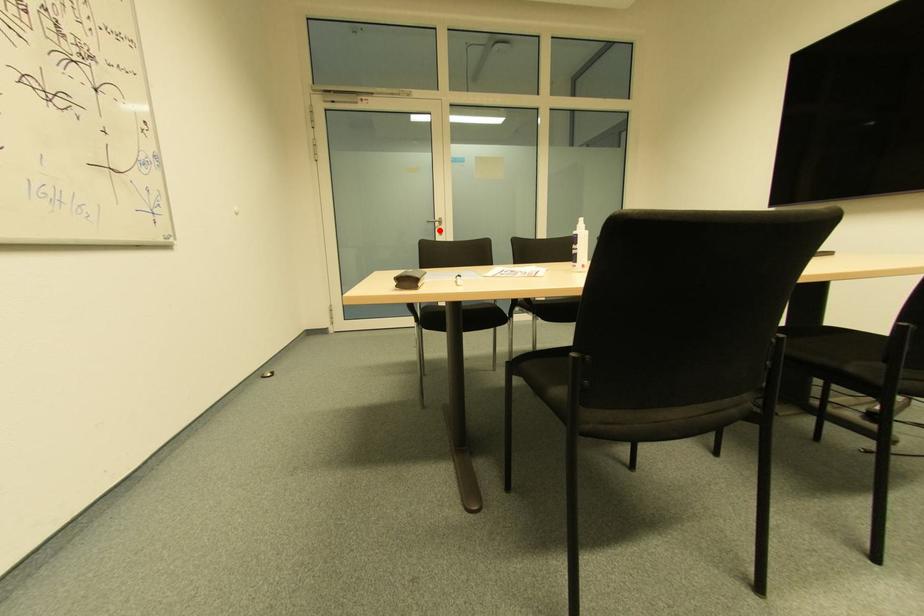
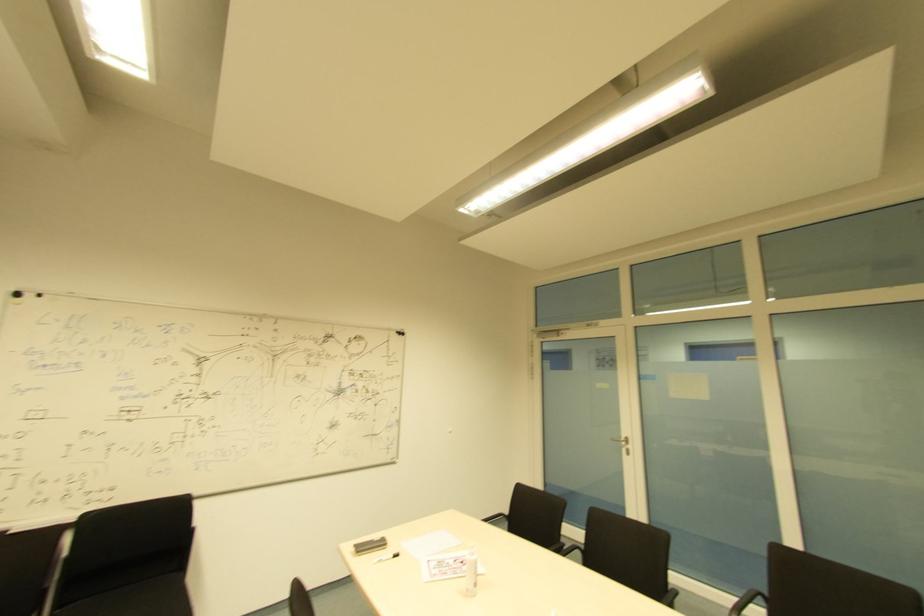
Find the pixel in the second image that matches the highlighted location in the first image.

(628, 450)